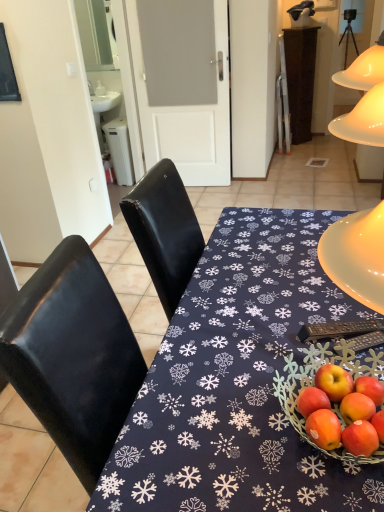
I want to click on free space that is to the left of black plastic remote control at lower right, so click(x=272, y=326).